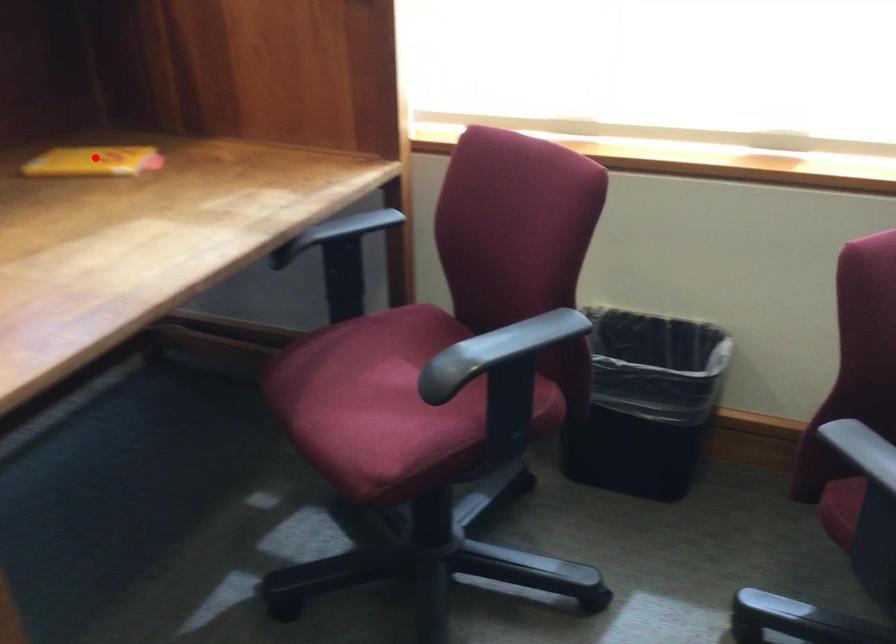
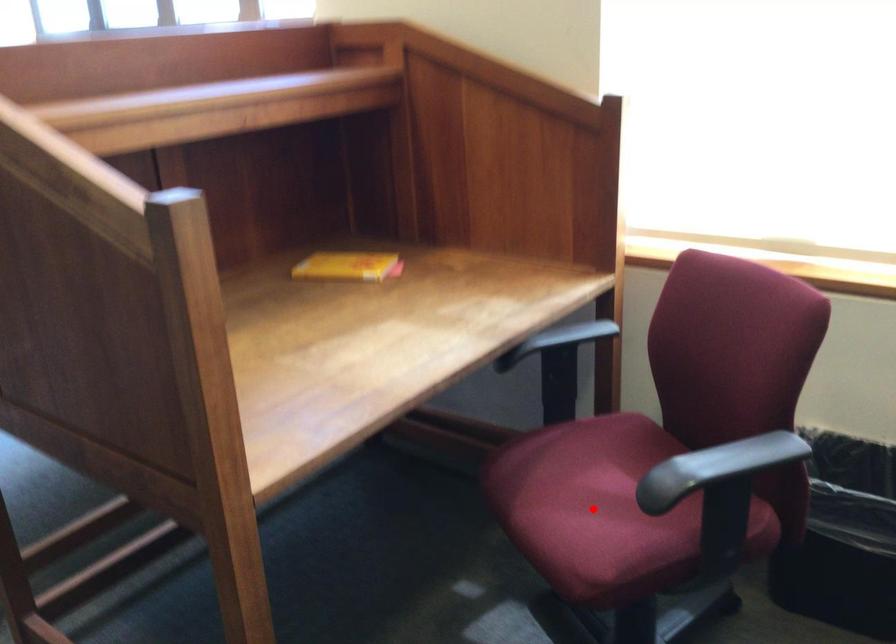
I am providing you with two images of the same scene from different viewpoints. A red point is marked on the first image and another point is marked on the second image. Does the point marked in image1 correspond to the same location as the one in image2?

No